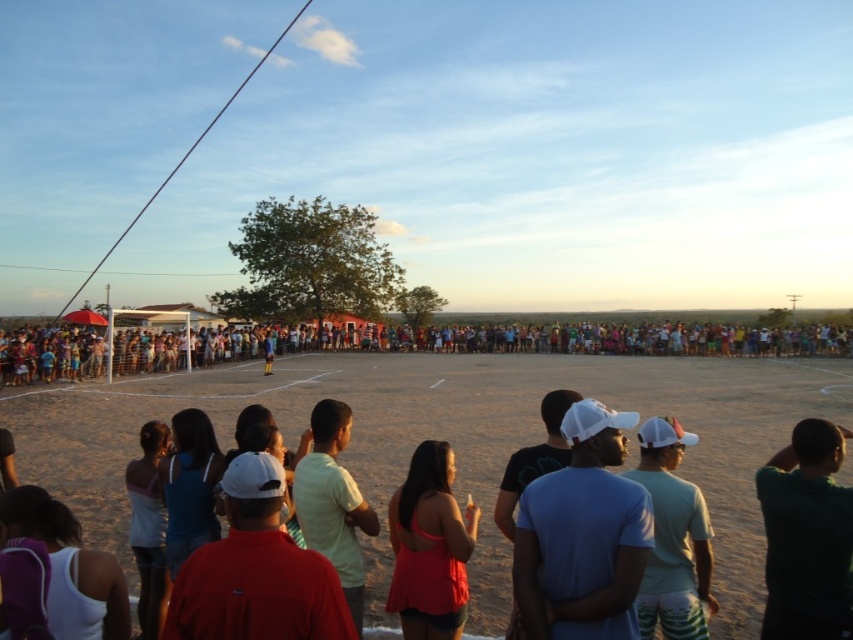
You are a photographer trying to capture a photo of both the point at (815, 349) and the point at (666, 577) in the image. Which point is closer to your camera position?

The point at (815, 349) is closer to the camera than the point at (666, 577) because it is further to the camera.